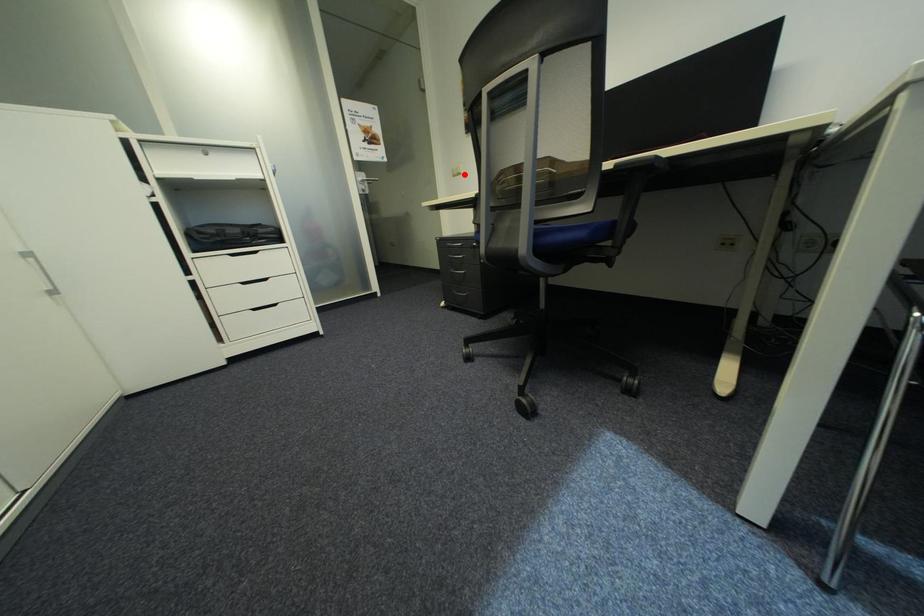
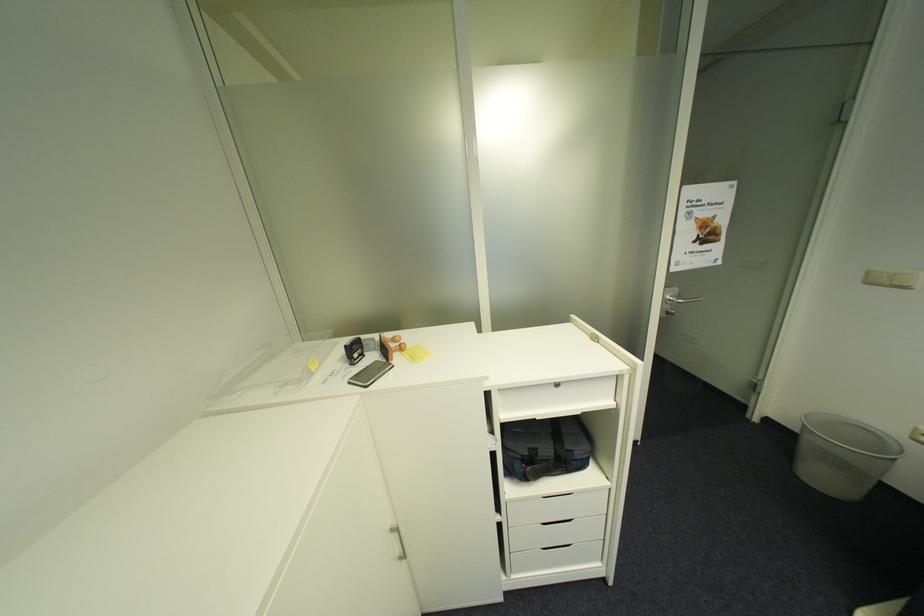
Question: A red point is marked in image1. In image2, is the corresponding 3D point closer to the camera or farther? Reply with the corresponding letter.

Choices:
 (A) The corresponding 3D point is closer.
 (B) The corresponding 3D point is farther.

Answer: (B)